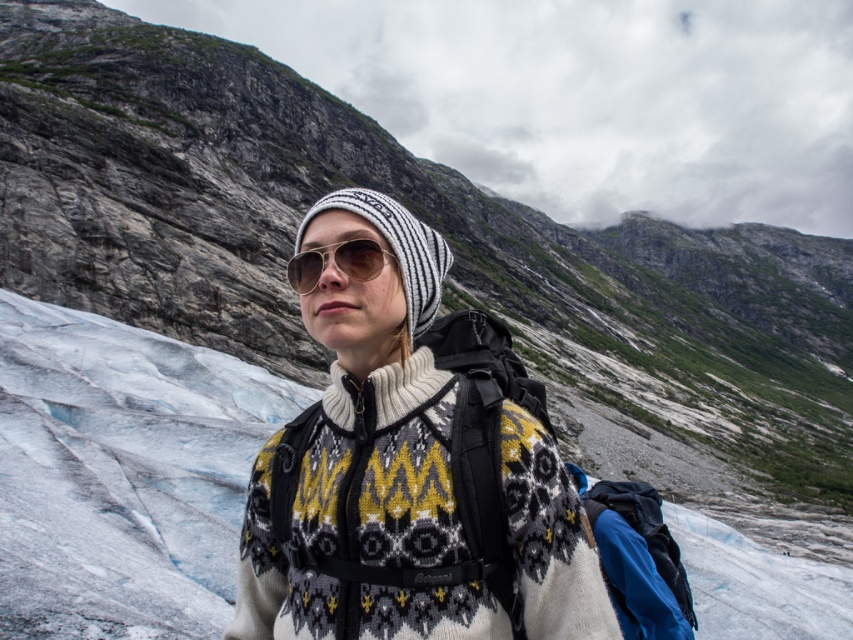
Question: Can you confirm if white knitted sweater at center is thinner than brown reflective sunglasses at center?

Choices:
 (A) no
 (B) yes

Answer: (A)

Question: Can you confirm if white knitted sweater at center is smaller than white knit beanie at center?

Choices:
 (A) no
 (B) yes

Answer: (A)

Question: Can you confirm if white knit beanie at center is positioned below brown reflective sunglasses at center?

Choices:
 (A) yes
 (B) no

Answer: (B)

Question: Which object appears closest to the camera in this image?

Choices:
 (A) white knitted sweater at center
 (B) brown reflective sunglasses at center
 (C) white knit beanie at center

Answer: (A)

Question: Which point appears farthest from the camera in this image?

Choices:
 (A) (235, 611)
 (B) (415, 314)
 (C) (360, 266)

Answer: (A)

Question: Which point is closer to the camera taking this photo?

Choices:
 (A) (332, 304)
 (B) (407, 260)
 (C) (373, 269)

Answer: (A)